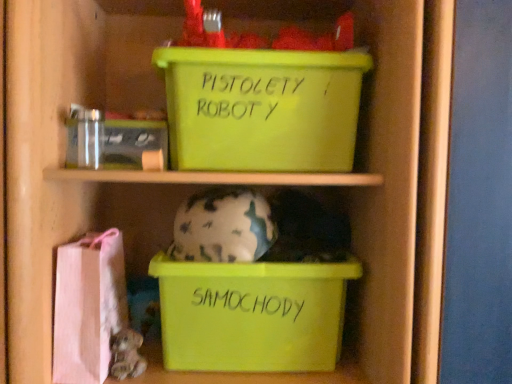
Question: From the image's perspective, is green plastic storage box at upper center, placed as the 1th storage box when sorted from top to bottom, positioned above or below matte green plastic box at lower center, which is counted as the 3th storage box, starting from the top?

Choices:
 (A) below
 (B) above

Answer: (B)

Question: Visually, is green plastic storage box at upper center, positioned as the third storage box in bottom-to-top order, positioned to the left or to the right of matte green plastic box at lower center, the 1th storage box positioned from the bottom?

Choices:
 (A) right
 (B) left

Answer: (A)

Question: Estimate the real-world distances between objects in this image. Which object is closer to the clear plastic jar at upper left, acting as the second storage box starting from the bottom?

Choices:
 (A) camouflage-patterned ceramic piggy bank at center
 (B) pink fabric bag at lower left
 (C) matte green plastic box at lower center, the 1th storage box positioned from the bottom
 (D) green plastic storage box at upper center, positioned as the third storage box in bottom-to-top order

Answer: (A)

Question: Which of these objects is positioned closest to the pink fabric bag at lower left?

Choices:
 (A) camouflage-patterned ceramic piggy bank at center
 (B) matte green plastic box at lower center, which is counted as the 3th storage box, starting from the top
 (C) green plastic storage box at upper center, positioned as the third storage box in bottom-to-top order
 (D) clear plastic jar at upper left, the second storage box viewed from the top

Answer: (A)